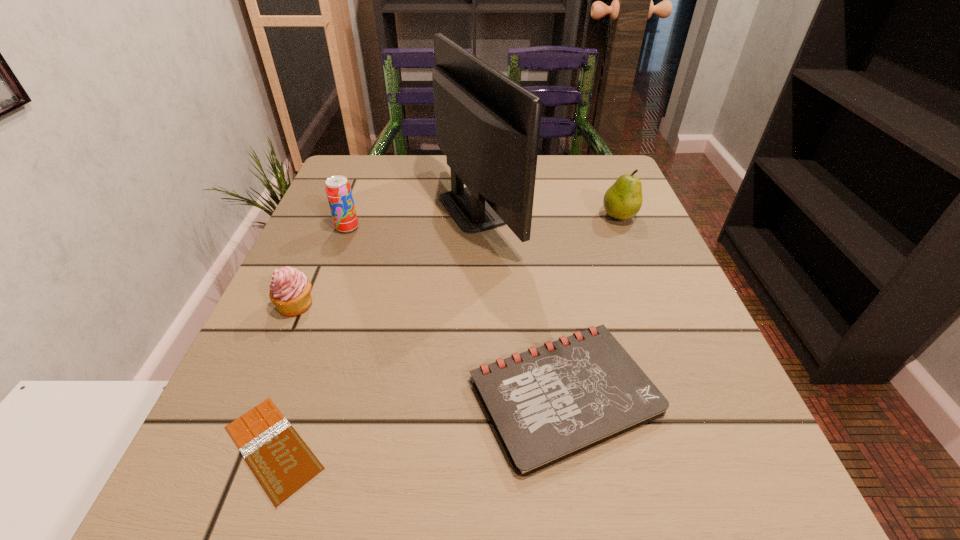
The width and height of the screenshot is (960, 540). What are the coordinates of `free space located on the right of the third nearest object` in the screenshot? It's located at (355, 305).

Locate an element on the screen. The height and width of the screenshot is (540, 960). vacant space located 0.250m on the left of the fifth tallest object is located at coordinates (300, 395).

Locate an element on the screen. vacant space located 0.240m on the back of the chocolate bar is located at coordinates pyautogui.click(x=332, y=286).

Where is `object present at the far edge`? object present at the far edge is located at coordinates (488, 126).

The width and height of the screenshot is (960, 540). Identify the location of notebook that is positioned at the near edge. (549, 403).

Identify the location of chocolate bar at the near edge. click(282, 462).

Find the location of a particular element. The width and height of the screenshot is (960, 540). soda can at the left edge is located at coordinates (338, 190).

The height and width of the screenshot is (540, 960). Identify the location of cupcake present at the left edge. (290, 289).

The width and height of the screenshot is (960, 540). I want to click on chocolate bar located at the left edge, so click(x=282, y=462).

Where is `pear that is positioned at the right edge`? This screenshot has width=960, height=540. pear that is positioned at the right edge is located at coordinates (623, 200).